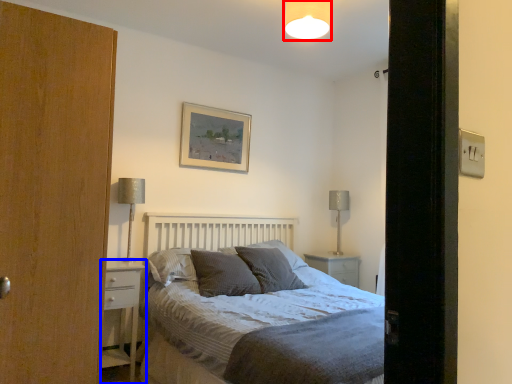
Question: Which object is closer to the camera taking this photo, light fixture (highlighted by a red box) or nightstand (highlighted by a blue box)?

Choices:
 (A) light fixture
 (B) nightstand

Answer: (A)